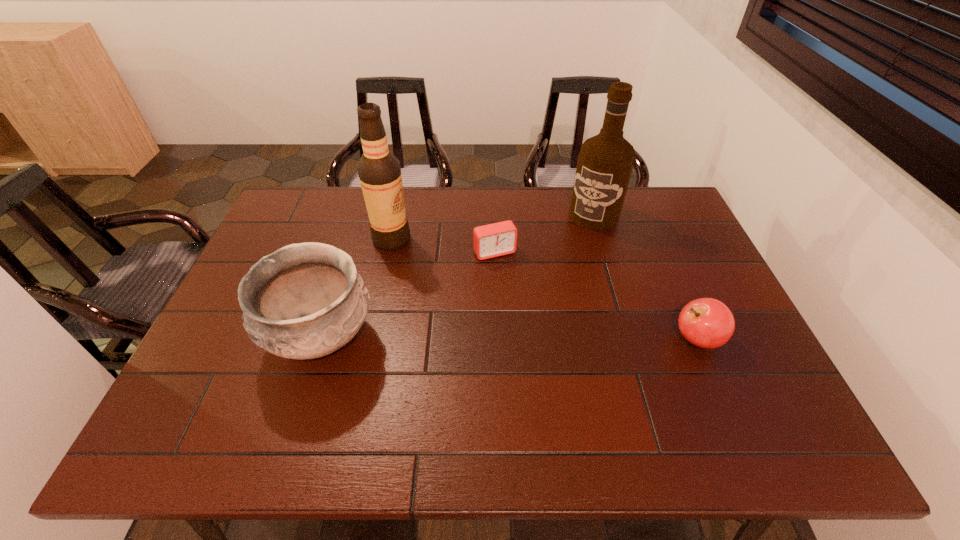
At what (x,y) coordinates should I click in order to perform the action: click on vacant space that is in between the left alcohol and the fourth tallest object. Please return your answer as a coordinate pair (x, y). Image resolution: width=960 pixels, height=540 pixels. Looking at the image, I should click on (544, 289).

At what (x,y) coordinates should I click in order to perform the action: click on vacant space that is in between the fourth tallest object and the left alcohol. Please return your answer as a coordinate pair (x, y). Looking at the image, I should click on point(544,289).

Where is `vacant space that is in between the rightmost object and the alarm clock`? vacant space that is in between the rightmost object and the alarm clock is located at coordinates (596, 296).

This screenshot has height=540, width=960. In order to click on vacant area that lies between the third shortest object and the shortest object in this screenshot , I will do `click(408, 295)`.

This screenshot has width=960, height=540. I want to click on unoccupied area between the rightmost object and the pottery, so click(509, 339).

You are a GUI agent. You are given a task and a screenshot of the screen. Output one action in this format:
    pyautogui.click(x=<x>, y=<y>)
    Task: Click on the free area in between the apple and the pottery
    
    Given the screenshot: What is the action you would take?
    pos(509,339)

Identify the location of vacant area that lies between the rightmost object and the shortest object. (596, 296).

Locate an element on the screen. object that is the fourth closest to the apple is located at coordinates (379, 171).

The width and height of the screenshot is (960, 540). In order to click on the closest object to the third tallest object in this screenshot , I will do `click(379, 171)`.

You are a GUI agent. You are given a task and a screenshot of the screen. Output one action in this format:
    pyautogui.click(x=<x>, y=<y>)
    Task: Click on the vacant space that satisfies the following two spatial constraints: 1. on the front side of the shortest object; 2. on the right side of the left alcohol
    The height and width of the screenshot is (540, 960).
    Given the screenshot: What is the action you would take?
    pyautogui.click(x=389, y=253)